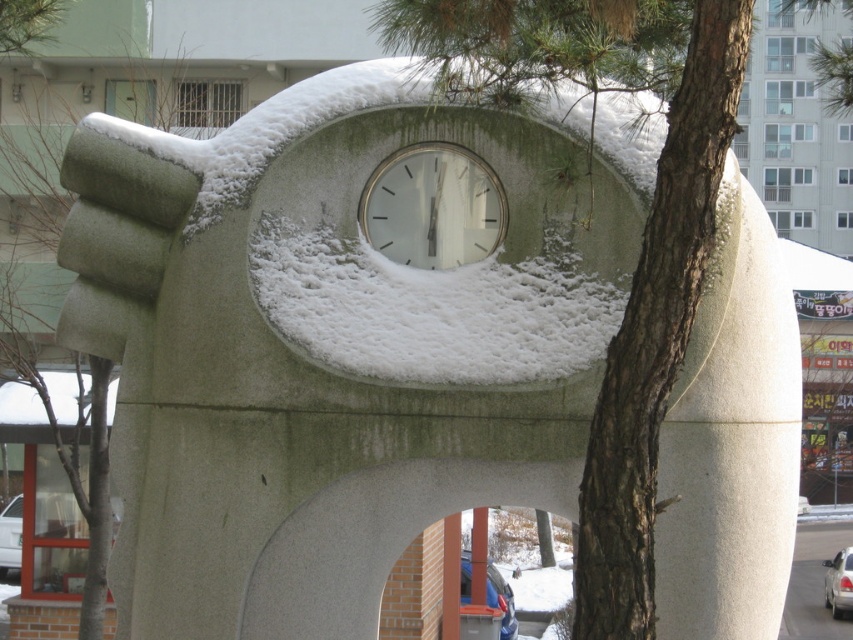
Which is in front, point (688, 262) or point (480, 576)?

Point (688, 262) is in front.

Which is more to the right, brown rough bark at center or metallic blue pole at center?

brown rough bark at center is more to the right.

Between point (585, 621) and point (476, 545), which one is positioned in front?

Point (585, 621)

Identify the location of brown rough bark at center. (656, 333).

Which is in front, point (392, 346) or point (409, 244)?

Point (392, 346) is more forward.

Locate an element on the screen. white fluffy snow at center is located at coordinates (430, 305).

Is point (611, 528) positioned before point (379, 250)?

Yes, it is in front of point (379, 250).

In the scene shown: Can you confirm if brown rough bark at center is positioned above white matte clock at center?

No, brown rough bark at center is not above white matte clock at center.

Consider the image. Who is more distant from viewer, (648, 465) or (485, 212)?

Positioned behind is point (485, 212).

This screenshot has width=853, height=640. I want to click on brown rough bark at center, so click(656, 333).